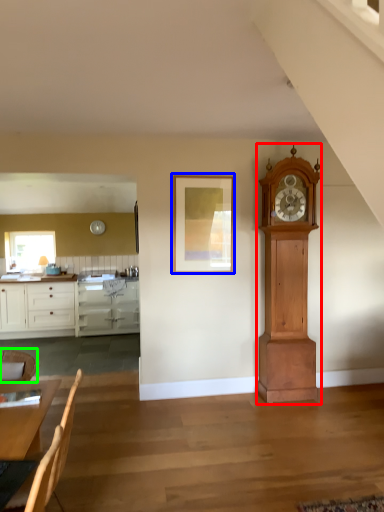
Question: Which object is the closest to the wall clock (highlighted by a red box)? Choose among these: picture frame (highlighted by a blue box) or chair (highlighted by a green box).

Choices:
 (A) picture frame
 (B) chair

Answer: (A)